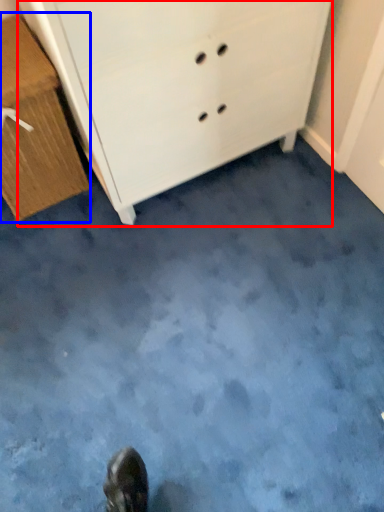
Question: Which object is closer to the camera taking this photo, chest of drawers (highlighted by a red box) or chest of drawers (highlighted by a blue box)?

Choices:
 (A) chest of drawers
 (B) chest of drawers

Answer: (A)